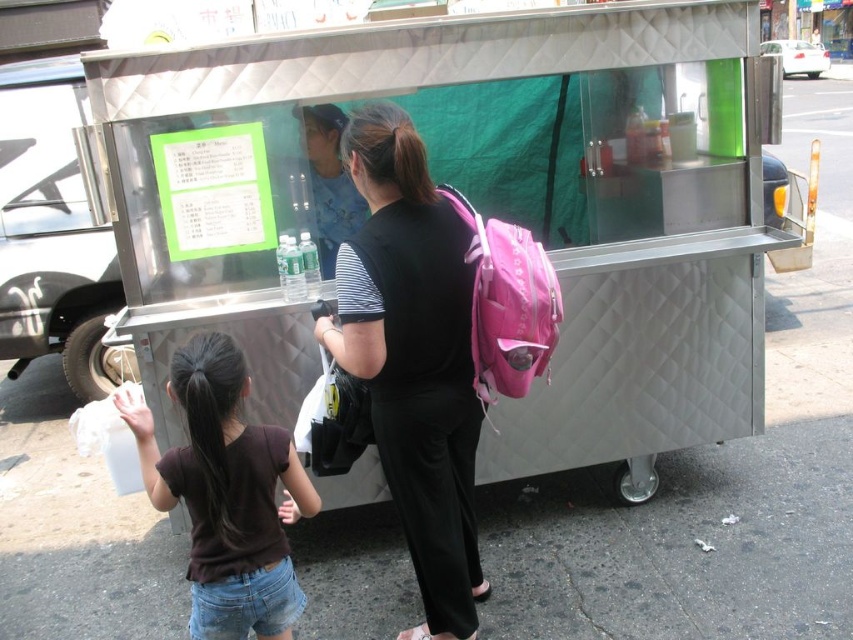
You are standing at the entrance of a building and see the stainless steel cart at center. If you walk straight ahead, will you reach the cart before reaching the sidewalk?

The stainless steel cart at center is located at point (x=476, y=205), which is closer to you than the sidewalk. Therefore, you will reach the cart before the sidewalk.

You are a delivery person who needs to deliver a package to the brown cotton shirt at lower left. The pink fabric backpack at center is blocking your path. Can you go around it without moving the backpack? Explain your reasoning.

The pink fabric backpack at center is further to the viewer than the brown cotton shirt at lower left, meaning the backpack is closer to you. Since the backpack is blocking the path, you can go around it by moving to the left or right side of the backpack to reach the brown cotton shirt at lower left without moving it.